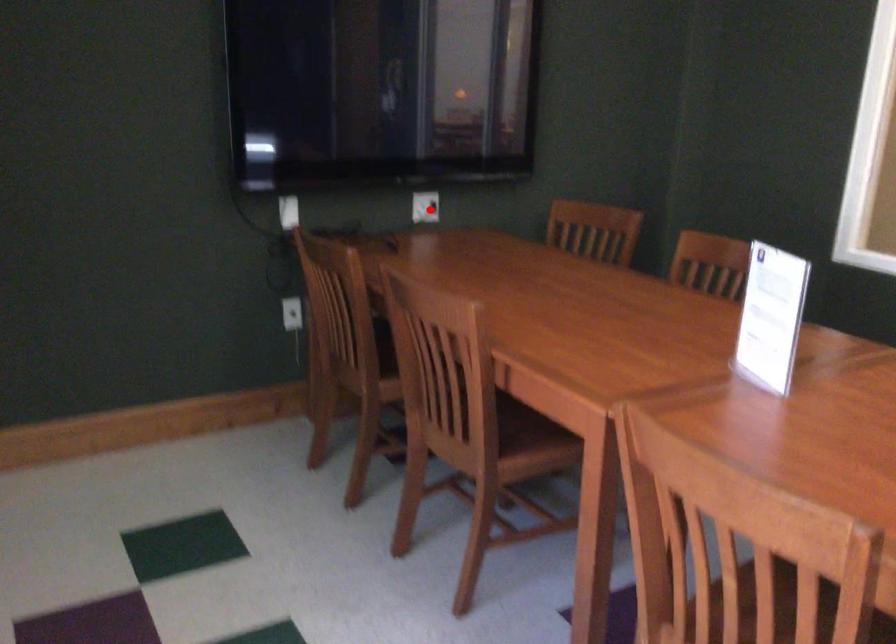
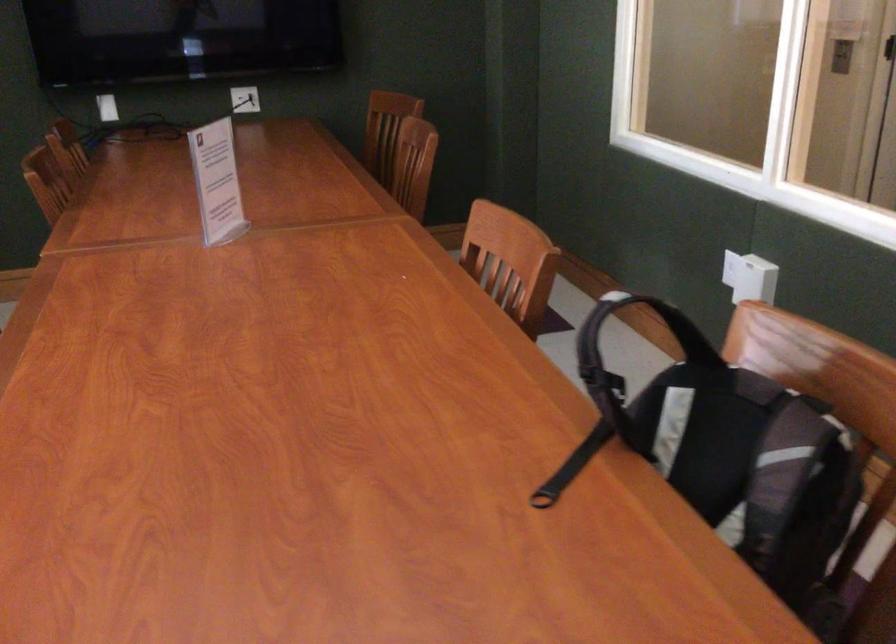
Find the pixel in the second image that matches the highlighted location in the first image.

(245, 99)